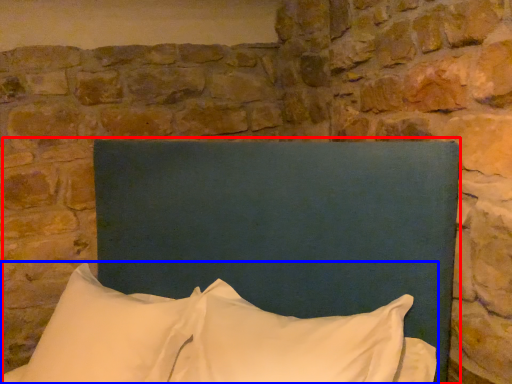
Question: Which object appears farthest to the camera in this image, bed (highlighted by a red box) or pillow (highlighted by a blue box)?

Choices:
 (A) bed
 (B) pillow

Answer: (B)